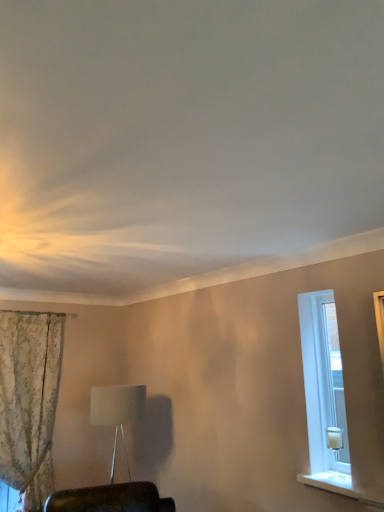
Question: From the image's perspective, is floral fabric curtain at left beneath white smooth window sill at lower right?

Choices:
 (A) yes
 (B) no

Answer: (A)

Question: Is the depth of floral fabric curtain at left greater than that of white smooth window sill at lower right?

Choices:
 (A) yes
 (B) no

Answer: (A)

Question: Is floral fabric curtain at left shorter than white smooth window sill at lower right?

Choices:
 (A) no
 (B) yes

Answer: (A)

Question: Does floral fabric curtain at left have a larger size compared to white smooth window sill at lower right?

Choices:
 (A) yes
 (B) no

Answer: (A)

Question: Is floral fabric curtain at left looking in the opposite direction of white smooth window sill at lower right?

Choices:
 (A) yes
 (B) no

Answer: (B)

Question: Is there a large distance between floral fabric curtain at left and white smooth window sill at lower right?

Choices:
 (A) yes
 (B) no

Answer: (A)

Question: Is white glass candle at right oriented away from floral fabric curtain at left?

Choices:
 (A) yes
 (B) no

Answer: (B)

Question: Is white glass candle at right facing towards floral fabric curtain at left?

Choices:
 (A) yes
 (B) no

Answer: (B)

Question: Is white glass candle at right positioned far away from floral fabric curtain at left?

Choices:
 (A) yes
 (B) no

Answer: (A)

Question: Can you confirm if white glass candle at right is positioned to the left of floral fabric curtain at left?

Choices:
 (A) no
 (B) yes

Answer: (A)

Question: Is white glass candle at right behind floral fabric curtain at left?

Choices:
 (A) yes
 (B) no

Answer: (B)

Question: Does white glass candle at right have a smaller size compared to floral fabric curtain at left?

Choices:
 (A) no
 (B) yes

Answer: (B)

Question: Is white fabric lampshade at center further to the viewer compared to floral fabric curtain at left?

Choices:
 (A) no
 (B) yes

Answer: (A)